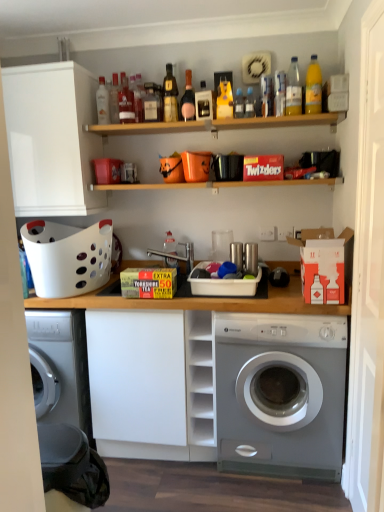
This screenshot has height=512, width=384. I want to click on white plastic basket at left, acting as the 1th basket starting from the left, so pyautogui.click(x=67, y=257).

You are a GUI agent. You are given a task and a screenshot of the screen. Output one action in this format:
    pyautogui.click(x=<x>, y=<y>)
    Task: Click on the cardboard box at center, which is the 2th cardboard box in right-to-left order
    
    Given the screenshot: What is the action you would take?
    pyautogui.click(x=148, y=282)

What do you see at coordinates (281, 394) in the screenshot? I see `satin silver washing machine at lower right` at bounding box center [281, 394].

In order to face white matte cabinet at upper left, should I rotate leftwards or rightwards?

You should rotate left by 19.077 degrees.

What do you see at coordinates (224, 100) in the screenshot? The height and width of the screenshot is (512, 384). I see `yellow plastic bottle at upper center, acting as the 7th bottle starting from the left` at bounding box center [224, 100].

What do you see at coordinates (137, 97) in the screenshot?
I see `translucent glass bottle at upper center, the 9th bottle in the right-to-left sequence` at bounding box center [137, 97].

Find the location of a particular element. white plastic basket at left, acting as the 1th basket starting from the left is located at coordinates (67, 257).

The image size is (384, 512). In order to click on basket above the cardboard box at center, which is the 1th cardboard box in left-to-right order (from a real-world perspective) in this screenshot , I will do `click(67, 257)`.

How far apart are cardboard box at center, which is the 2th cardboard box in right-to-left order, and white plastic basket at left, acting as the 1th basket starting from the left?

cardboard box at center, which is the 2th cardboard box in right-to-left order, and white plastic basket at left, acting as the 1th basket starting from the left, are 14.21 inches apart from each other.

Which object is further away from the camera, cardboard box at center, which is the 1th cardboard box in left-to-right order, or white plastic basket at left, acting as the second basket starting from the right?

white plastic basket at left, acting as the second basket starting from the right, is further away from the camera.

Is cardboard box at center, which is the 2th cardboard box in right-to-left order, not near white plastic basket at left, acting as the 1th basket starting from the left?

No.

Is white cardboard box at right, which appears as the 2th cardboard box when viewed from the left, completely or partially inside matte white bottle at center, which ranks as the 4th bottle in left-to-right order?

No, white cardboard box at right, which appears as the 2th cardboard box when viewed from the left, is located outside of matte white bottle at center, which ranks as the 4th bottle in left-to-right order.

Is white cardboard box at right, which appears as the 2th cardboard box when viewed from the left, at the back of matte white bottle at center, which ranks as the 4th bottle in left-to-right order?

No, white cardboard box at right, which appears as the 2th cardboard box when viewed from the left, is not at the back of matte white bottle at center, which ranks as the 4th bottle in left-to-right order.

From a real-world perspective, does matte white bottle at center, arranged as the seventh bottle when viewed from the right, sit lower than white cardboard box at right, which ranks as the first cardboard box in right-to-left order?

Indeed, from a real-world perspective, matte white bottle at center, arranged as the seventh bottle when viewed from the right, is positioned beneath white cardboard box at right, which ranks as the first cardboard box in right-to-left order.

From the picture: How distant is matte white bottle at center, which ranks as the 4th bottle in left-to-right order, from white cardboard box at right, which ranks as the first cardboard box in right-to-left order?

A distance of 92.90 centimeters exists between matte white bottle at center, which ranks as the 4th bottle in left-to-right order, and white cardboard box at right, which ranks as the first cardboard box in right-to-left order.

Is matte white bottle at center, which ranks as the 4th bottle in left-to-right order, wider than white plastic basket at left, acting as the second basket starting from the right?

No, matte white bottle at center, which ranks as the 4th bottle in left-to-right order, is not wider than white plastic basket at left, acting as the second basket starting from the right.

From the image's perspective, is matte white bottle at center, which ranks as the 4th bottle in left-to-right order, above white plastic basket at left, acting as the second basket starting from the right?

Yes.

Can you confirm if matte white bottle at center, which ranks as the 4th bottle in left-to-right order, is positioned to the right of white plastic basket at left, acting as the 1th basket starting from the left?

Yes, matte white bottle at center, which ranks as the 4th bottle in left-to-right order, is to the right of white plastic basket at left, acting as the 1th basket starting from the left.

In terms of size, does matte white bottle at center, which ranks as the 4th bottle in left-to-right order, appear bigger or smaller than white plastic basket at left, acting as the 1th basket starting from the left?

matte white bottle at center, which ranks as the 4th bottle in left-to-right order, is smaller than white plastic basket at left, acting as the 1th basket starting from the left.

How far apart are yellow plastic bottle at upper center, which is the fourth bottle from right to left, and matte glass bottle at upper center, which appears as the tenth bottle when viewed from the right?

20.90 inches.

Considering the positions of point (219, 115) and point (120, 109), is point (219, 115) closer or farther from the camera than point (120, 109)?

Point (219, 115).

Would you say yellow plastic bottle at upper center, which is the fourth bottle from right to left, contains matte glass bottle at upper center, which appears as the tenth bottle when viewed from the right?

No, matte glass bottle at upper center, which appears as the tenth bottle when viewed from the right, is located outside of yellow plastic bottle at upper center, which is the fourth bottle from right to left.

Is white matte cabinet at upper left looking in the opposite direction of white cardboard box at right, which appears as the 2th cardboard box when viewed from the left?

No, white matte cabinet at upper left is not facing the opposite direction of white cardboard box at right, which appears as the 2th cardboard box when viewed from the left.

Between white matte cabinet at upper left and white cardboard box at right, which appears as the 2th cardboard box when viewed from the left, which one has less height?

Standing shorter between the two is white cardboard box at right, which appears as the 2th cardboard box when viewed from the left.

From the image's perspective, is white matte cabinet at upper left positioned above or below white cardboard box at right, which ranks as the first cardboard box in right-to-left order?

white matte cabinet at upper left is above white cardboard box at right, which ranks as the first cardboard box in right-to-left order.

Is white matte cabinet at upper left positioned far away from white cardboard box at right, which ranks as the first cardboard box in right-to-left order?

Indeed, white matte cabinet at upper left is not near white cardboard box at right, which ranks as the first cardboard box in right-to-left order.

Consider the image. Is matte glass bottle at upper center, the fifth bottle viewed from the right, thinner than white matte cabinet at upper left?

Correct, the width of matte glass bottle at upper center, the fifth bottle viewed from the right, is less than that of white matte cabinet at upper left.

What's the angular difference between matte glass bottle at upper center, the fifth bottle viewed from the right, and white matte cabinet at upper left's facing directions?

The angle between the facing direction of matte glass bottle at upper center, the fifth bottle viewed from the right, and the facing direction of white matte cabinet at upper left is 0.367 degrees.

Does matte glass bottle at upper center, the fifth bottle viewed from the right, turn towards white matte cabinet at upper left?

No, matte glass bottle at upper center, the fifth bottle viewed from the right, is not facing towards white matte cabinet at upper left.

Between matte glass bottle at upper center, the sixth bottle viewed from the left, and white matte cabinet at upper left, which one appears on the right side from the viewer's perspective?

Positioned to the right is matte glass bottle at upper center, the sixth bottle viewed from the left.

Is translucent plastic bottle at upper center, positioned as the 2th bottle in right-to-left order, completely or partially inside matte white bottle at center, arranged as the seventh bottle when viewed from the right?

No, translucent plastic bottle at upper center, positioned as the 2th bottle in right-to-left order, is not a part of matte white bottle at center, arranged as the seventh bottle when viewed from the right.

Is matte white bottle at center, which ranks as the 4th bottle in left-to-right order, positioned in front of translucent plastic bottle at upper center, positioned as the 2th bottle in right-to-left order?

No.

Is matte white bottle at center, arranged as the seventh bottle when viewed from the right, at the left side of translucent plastic bottle at upper center, positioned as the 2th bottle in right-to-left order?

Indeed, matte white bottle at center, arranged as the seventh bottle when viewed from the right, is positioned on the left side of translucent plastic bottle at upper center, positioned as the 2th bottle in right-to-left order.

Is point (172, 264) closer or farther from the camera than point (297, 84)?

Point (172, 264) is positioned closer to the camera compared to point (297, 84).

From the image's perspective, which cardboard box is the 2nd one below the white plastic basket at left, acting as the 1th basket starting from the left? Please provide its 2D coordinates.

[(148, 282)]

I want to click on bottle that is the 1st object located above the white cardboard box at right, which appears as the 2th cardboard box when viewed from the left (from the image's perspective), so click(169, 244).

Based on their spatial positions, is white cardboard box at right, which appears as the 2th cardboard box when viewed from the left, or translucent plastic bottle at upper center, arranged as the ninth bottle when viewed from the left, closer to white plastic basket at left, acting as the 1th basket starting from the left?

white cardboard box at right, which appears as the 2th cardboard box when viewed from the left, is closer to white plastic basket at left, acting as the 1th basket starting from the left.

Estimate the real-world distances between objects in this image. Which object is further from translucent plastic bottle at upper right, which appears as the 10th bottle when viewed from the left, white plastic basket at left, acting as the second basket starting from the right, or wooden shelf at upper center?

white plastic basket at left, acting as the second basket starting from the right.

Consider the image. From the image, which object appears to be farther from white matte cabinet at upper left, matte glass bottle at upper center, the fifth bottle viewed from the right, or translucent plastic bottle at upper center, placed as the eighth bottle when sorted from left to right?

Among the two, translucent plastic bottle at upper center, placed as the eighth bottle when sorted from left to right, is located further to white matte cabinet at upper left.

From the image, which object appears to be farther from white plastic basket at left, acting as the 1th basket starting from the left, translucent glass bottle at upper center, the second bottle viewed from the left, or white cardboard box at right, which appears as the 2th cardboard box when viewed from the left?

Based on the image, white cardboard box at right, which appears as the 2th cardboard box when viewed from the left, appears to be further to white plastic basket at left, acting as the 1th basket starting from the left.

Which object lies further to the anchor point white plastic basket at left, acting as the second basket starting from the right, matte glass bottle at upper center, which appears as the tenth bottle when viewed from the right, or white cardboard box at right, which appears as the 2th cardboard box when viewed from the left?

The object further to white plastic basket at left, acting as the second basket starting from the right, is white cardboard box at right, which appears as the 2th cardboard box when viewed from the left.

Estimate the real-world distances between objects in this image. Which object is closer to satin silver washing machine at lower right, translucent glass bottle at upper center, acting as the fifth bottle starting from the left, or translucent glass bottle at upper center, the 9th bottle in the right-to-left sequence?

Among the two, translucent glass bottle at upper center, acting as the fifth bottle starting from the left, is located nearer to satin silver washing machine at lower right.

From the image, which object appears to be nearer to cardboard box at center, which is the 1th cardboard box in left-to-right order, matte glass bottle at upper center, which appears as the tenth bottle when viewed from the right, or white plastic basket at center, the first basket in the right-to-left sequence?

white plastic basket at center, the first basket in the right-to-left sequence, is positioned closer to the anchor cardboard box at center, which is the 1th cardboard box in left-to-right order.

From the image, which object appears to be nearer to translucent glass bottle at upper center, the second bottle viewed from the left, yellow plastic bottle at upper center, which is the fourth bottle from right to left, or matte glass bottle at center, acting as the 8th bottle starting from the right?

Based on the image, matte glass bottle at center, acting as the 8th bottle starting from the right, appears to be nearer to translucent glass bottle at upper center, the second bottle viewed from the left.

This screenshot has width=384, height=512. Identify the location of cardboard box between translucent glass bottle at upper center, the 9th bottle in the right-to-left sequence, and white plastic basket at center, the first basket in the right-to-left sequence, in the up-down direction. (324, 264).

Locate an element on the screen. bottle between translucent plastic bottle at upper center, the 3th bottle viewed from the right, and white plastic basket at center, the second basket positioned from the left, in the vertical direction is located at coordinates (169, 244).

The height and width of the screenshot is (512, 384). What are the coordinates of `cardboard box between translucent plastic bottle at upper center, positioned as the 2th bottle in right-to-left order, and white plastic basket at center, the second basket positioned from the left, vertically` in the screenshot? It's located at (324, 264).

At what (x,y) coordinates should I click in order to perform the action: click on shelf that lies between translucent plastic bottle at upper right, which appears as the 10th bottle when viewed from the left, and cardboard box at center, which is the 2th cardboard box in right-to-left order, from top to bottom. Please return your answer as a coordinate pair (x, y). This screenshot has width=384, height=512. Looking at the image, I should click on (217, 124).